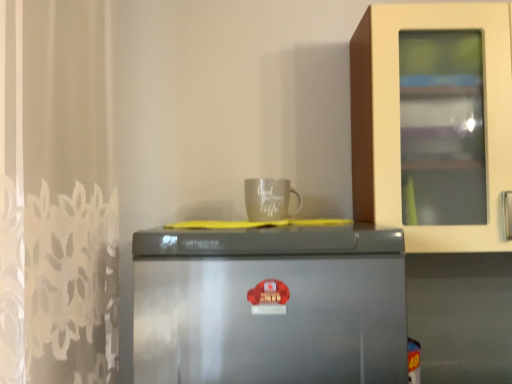
Question: Considering the relative positions of gray matte mug at upper center and satin silver fridge at center in the image provided, is gray matte mug at upper center to the left or to the right of satin silver fridge at center?

Choices:
 (A) left
 (B) right

Answer: (B)

Question: From the image's perspective, is gray matte mug at upper center located above or below satin silver fridge at center?

Choices:
 (A) above
 (B) below

Answer: (A)

Question: In terms of height, does gray matte mug at upper center look taller or shorter compared to satin silver fridge at center?

Choices:
 (A) short
 (B) tall

Answer: (A)

Question: Based on their sizes in the image, would you say satin silver fridge at center is bigger or smaller than gray matte mug at upper center?

Choices:
 (A) big
 (B) small

Answer: (A)

Question: From the image's perspective, relative to gray matte mug at upper center, is satin silver fridge at center above or below?

Choices:
 (A) below
 (B) above

Answer: (A)

Question: In terms of width, does satin silver fridge at center look wider or thinner when compared to gray matte mug at upper center?

Choices:
 (A) thin
 (B) wide

Answer: (B)

Question: Does point (347, 284) appear closer or farther from the camera than point (286, 216)?

Choices:
 (A) closer
 (B) farther

Answer: (A)